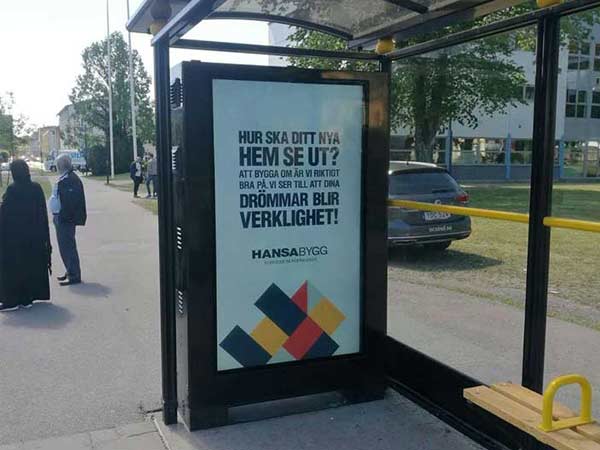
In order to click on bench in this screenshot , I will do `click(497, 398)`.